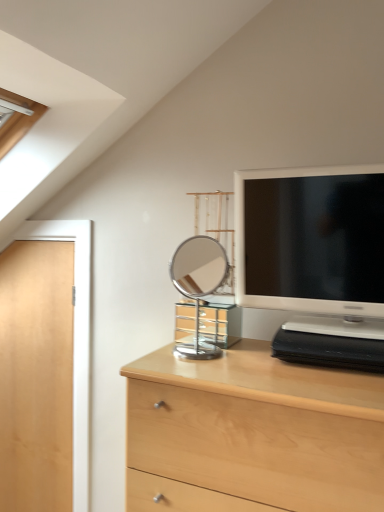
What do you see at coordinates (36, 376) in the screenshot? The width and height of the screenshot is (384, 512). I see `light wood door at left` at bounding box center [36, 376].

This screenshot has width=384, height=512. What do you see at coordinates (313, 247) in the screenshot?
I see `matte white television at upper right` at bounding box center [313, 247].

Find the location of a particular element. matte white television at upper right is located at coordinates (313, 247).

You are a GUI agent. You are given a task and a screenshot of the screen. Output one action in this format:
    pyautogui.click(x=<x>, y=<y>)
    Task: Click on the light wood door at left
    Image resolution: width=384 pixels, height=512 pixels.
    Given the screenshot: What is the action you would take?
    pyautogui.click(x=36, y=376)

Is polished chrome mirror at center positioned with its back to matte white television at upper right?

That's not correct — polished chrome mirror at center is not looking away from matte white television at upper right.

Considering the relative sizes of polished chrome mirror at center and matte white television at upper right in the image provided, is polished chrome mirror at center bigger than matte white television at upper right?

No.

There is a polished chrome mirror at center. Identify the location of television above it (from a real-world perspective). Image resolution: width=384 pixels, height=512 pixels. (313, 247).

Is polished chrome mirror at center far away from matte white television at upper right?

Actually, polished chrome mirror at center and matte white television at upper right are a little close together.

From the image's perspective, does light wood chest of drawers at center appear lower than light wood door at left?

Indeed, from the image's perspective, light wood chest of drawers at center is shown beneath light wood door at left.

Is light wood door at left at the back of light wood chest of drawers at center?

No, light wood chest of drawers at center's orientation is not away from light wood door at left.

Which is more to the right, light wood chest of drawers at center or light wood door at left?

From the viewer's perspective, light wood chest of drawers at center appears more on the right side.

From a real-world perspective, which is physically below, light wood chest of drawers at center or light wood door at left?

light wood chest of drawers at center is physically lower.

Are light wood chest of drawers at center and polished chrome mirror at center located far from each other?

Yes, light wood chest of drawers at center and polished chrome mirror at center are quite far apart.

At what (x,y) coordinates should I click in order to perform the action: click on the chest of drawers beneath the polished chrome mirror at center (from a real-world perspective). Please return your answer as a coordinate pair (x, y). Looking at the image, I should click on (252, 434).

Is light wood chest of drawers at center wider than polished chrome mirror at center?

Yes.

Looking at this image, which of these two, light wood chest of drawers at center or polished chrome mirror at center, is smaller?

Smaller between the two is polished chrome mirror at center.

Is matte white television at upper right far away from polished chrome mirror at center?

No, matte white television at upper right is not far from polished chrome mirror at center.

Does matte white television at upper right have a lesser width compared to polished chrome mirror at center?

In fact, matte white television at upper right might be wider than polished chrome mirror at center.

Is matte white television at upper right surrounding polished chrome mirror at center?

No, matte white television at upper right does not contain polished chrome mirror at center.

From the image's perspective, is matte white television at upper right positioned above or below light wood door at left?

Based on their image positions, matte white television at upper right is located above light wood door at left.

Considering the points (307, 244) and (42, 399), which point is in front, point (307, 244) or point (42, 399)?

The point (307, 244) is closer to the camera.

Can you confirm if matte white television at upper right is smaller than light wood door at left?

Yes, matte white television at upper right is smaller than light wood door at left.

How much distance is there between matte white television at upper right and light wood door at left?

The distance of matte white television at upper right from light wood door at left is 1.04 meters.

Can you confirm if polished chrome mirror at center is thinner than light wood chest of drawers at center?

Indeed, polished chrome mirror at center has a lesser width compared to light wood chest of drawers at center.

From a real-world perspective, between polished chrome mirror at center and light wood chest of drawers at center, who is vertically lower?

light wood chest of drawers at center, from a real-world perspective.

Is polished chrome mirror at center facing towards light wood chest of drawers at center?

No, polished chrome mirror at center is not aimed at light wood chest of drawers at center.

Is light wood chest of drawers at center turned away from matte white television at upper right?

That's not correct — light wood chest of drawers at center is not looking away from matte white television at upper right.

Is light wood chest of drawers at center situated inside matte white television at upper right or outside?

light wood chest of drawers at center cannot be found inside matte white television at upper right.

Based on their sizes in the image, would you say light wood chest of drawers at center is bigger or smaller than matte white television at upper right?

Considering their sizes, light wood chest of drawers at center takes up more space than matte white television at upper right.

From the image's perspective, is light wood chest of drawers at center below matte white television at upper right?

Yes, from the image's perspective, light wood chest of drawers at center is beneath matte white television at upper right.

I want to click on television located in front of the polished chrome mirror at center, so click(313, 247).

At what (x,y) coordinates should I click in order to perform the action: click on door on the left of light wood chest of drawers at center. Please return your answer as a coordinate pair (x, y). The height and width of the screenshot is (512, 384). Looking at the image, I should click on (36, 376).

Considering their positions, is matte white television at upper right positioned closer to light wood chest of drawers at center than light wood door at left?

matte white television at upper right is closer to light wood chest of drawers at center.

Which object lies nearer to the anchor point polished chrome mirror at center, light wood chest of drawers at center or light wood door at left?

light wood door at left is closer to polished chrome mirror at center.

Based on their spatial positions, is light wood chest of drawers at center or polished chrome mirror at center closer to light wood door at left?

polished chrome mirror at center is closer to light wood door at left.

Estimate the real-world distances between objects in this image. Which object is closer to light wood chest of drawers at center, polished chrome mirror at center or matte white television at upper right?

matte white television at upper right.

Looking at the image, which one is located closer to matte white television at upper right, polished chrome mirror at center or light wood door at left?

polished chrome mirror at center is closer to matte white television at upper right.

Considering their positions, is light wood chest of drawers at center positioned further to matte white television at upper right than light wood door at left?

Based on the image, light wood door at left appears to be further to matte white television at upper right.

Estimate the real-world distances between objects in this image. Which object is closer to light wood chest of drawers at center, light wood door at left or polished chrome mirror at center?

light wood door at left.

From the image, which object appears to be nearer to polished chrome mirror at center, light wood chest of drawers at center or matte white television at upper right?

Based on the image, matte white television at upper right appears to be nearer to polished chrome mirror at center.

Find the location of a particular element. This screenshot has height=512, width=384. mirror situated between light wood door at left and matte white television at upper right from left to right is located at coordinates click(x=198, y=285).

Find the location of `the chest of drawers located between light wood door at left and matte white television at upper right in the left-right direction`. the chest of drawers located between light wood door at left and matte white television at upper right in the left-right direction is located at coordinates (252, 434).

Identify the location of mirror between matte white television at upper right and light wood chest of drawers at center in the vertical direction. (198, 285).

Where is `mirror located between light wood chest of drawers at center and light wood door at left in the depth direction`? The width and height of the screenshot is (384, 512). mirror located between light wood chest of drawers at center and light wood door at left in the depth direction is located at coordinates (198, 285).